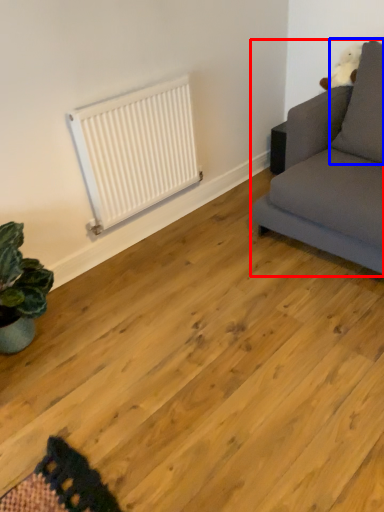
Question: Which point is further to the camera, studio couch (highlighted by a red box) or pillow (highlighted by a blue box)?

Choices:
 (A) studio couch
 (B) pillow

Answer: (B)